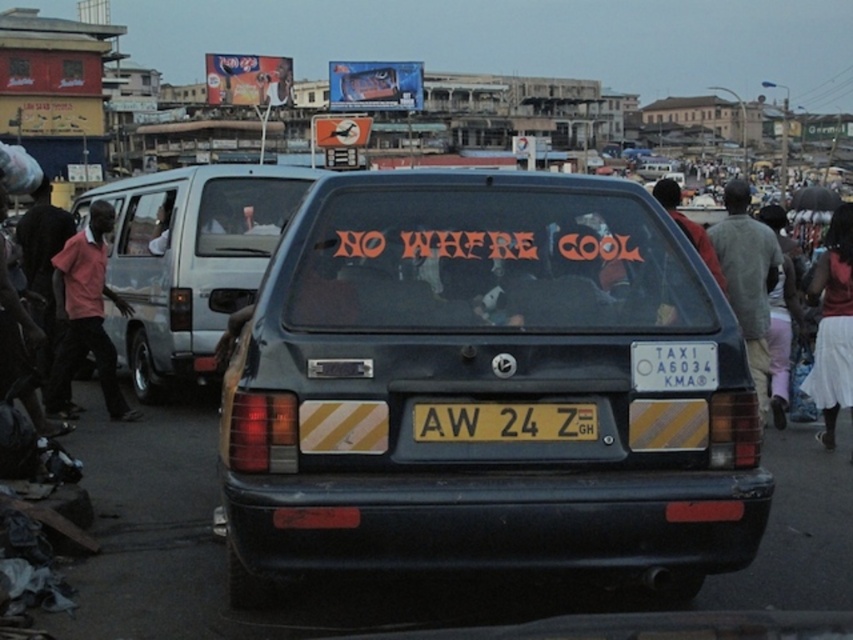
Question: Is pink fabric shirt at left bigger than yellow matte license plate at center?

Choices:
 (A) yes
 (B) no

Answer: (A)

Question: Does pink fabric shirt at left appear over white skirt at lower right?

Choices:
 (A) yes
 (B) no

Answer: (A)

Question: Based on their relative distances, which object is nearer to the pink fabric shirt at left?

Choices:
 (A) white skirt at lower right
 (B) matte black van at center
 (C) matte black car at center
 (D) yellow matte license plate at center

Answer: (B)

Question: Which of the following is the farthest from the observer?

Choices:
 (A) (264, 545)
 (B) (437, 403)
 (C) (111, 408)

Answer: (C)

Question: Among these points, which one is farthest from the camera?

Choices:
 (A) (132, 301)
 (B) (819, 397)

Answer: (A)

Question: Considering the relative positions of pink fabric shirt at left and white skirt at lower right in the image provided, where is pink fabric shirt at left located with respect to white skirt at lower right?

Choices:
 (A) right
 (B) left

Answer: (B)